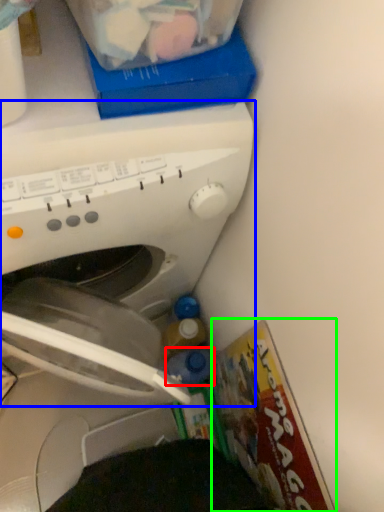
Question: Which is farther away from bottle (highlighted by a red box)? washing machine (highlighted by a blue box) or magazine (highlighted by a green box)?

Choices:
 (A) washing machine
 (B) magazine

Answer: (A)